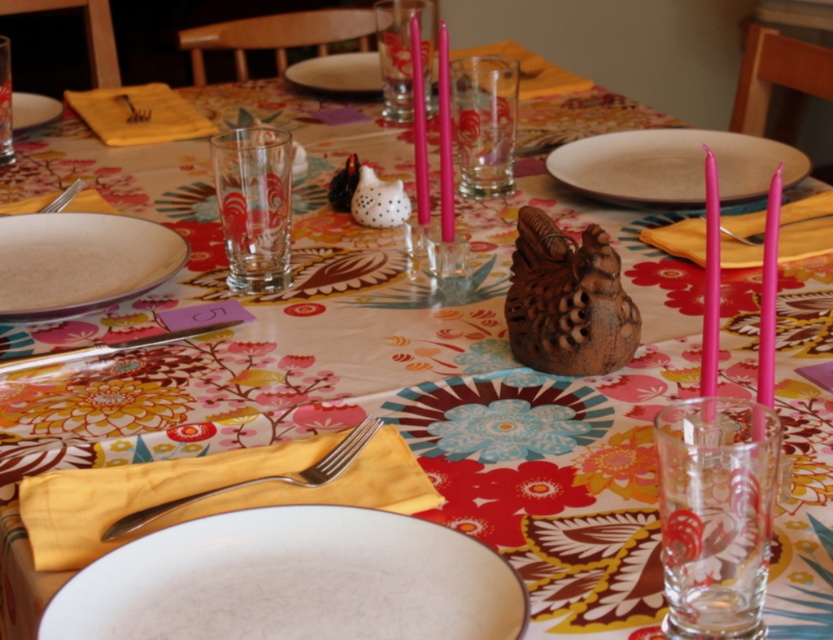
Describe the element at coordinates (262, 480) in the screenshot. I see `silver metallic fork at lower left` at that location.

Is silver metallic fork at lower left behind brushed metal fork at upper left?

No.

Where is `silver metallic fork at lower left`? The image size is (833, 640). silver metallic fork at lower left is located at coordinates (262, 480).

Where is `silver metallic fork at lower left`? silver metallic fork at lower left is located at coordinates (262, 480).

Is transparent glass candle holder at center to the right of white glossy plate at left from the viewer's perspective?

Correct, you'll find transparent glass candle holder at center to the right of white glossy plate at left.

Is transparent glass candle holder at center wider than white glossy plate at left?

Incorrect, transparent glass candle holder at center's width does not surpass white glossy plate at left's.

What do you see at coordinates (716, 513) in the screenshot?
I see `transparent glass candle holder at center` at bounding box center [716, 513].

What are the coordinates of `transparent glass candle holder at center` in the screenshot? It's located at (716, 513).

In the scene shown: Who is taller, white glossy plate at left or silver metallic fork at lower left?

white glossy plate at left is taller.

Is white glossy plate at left in front of silver metallic fork at lower left?

No, it is not.

Is point (0, 296) closer to viewer compared to point (315, 484)?

No, (0, 296) is further to viewer.

At what (x,y) coordinates should I click in order to perform the action: click on white glossy plate at left. Please return your answer as a coordinate pair (x, y). Looking at the image, I should click on (80, 262).